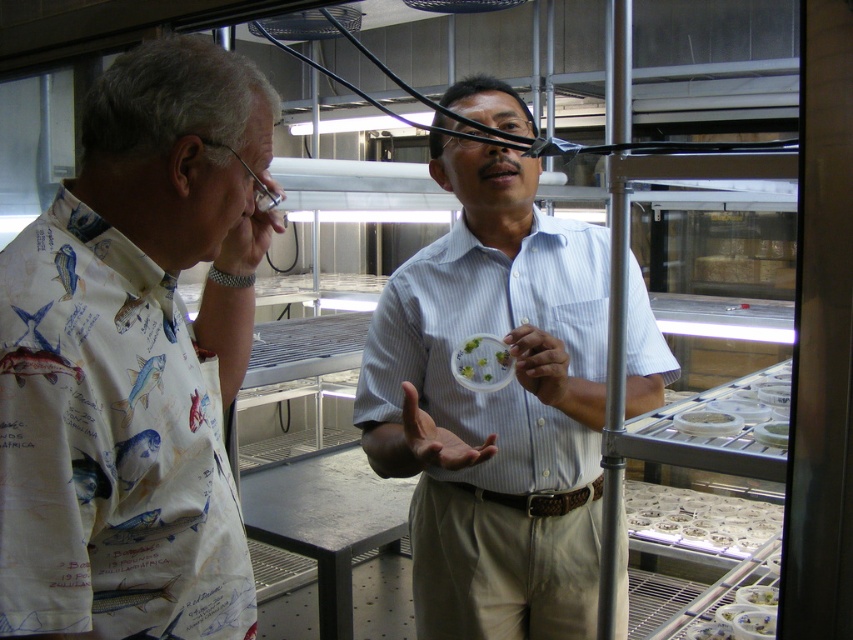
You are standing at point [682,416] in the lab. The two people are talking. Can you hear their conversation clearly?

The two people are 4.54 feet apart, so yes, you can hear their conversation clearly from point [682,416].

You are a researcher in the lab and need to determine which object is bigger between the white striped shirt at center and the translucent plastic container at center. Which one is larger?

The white striped shirt at center is larger than the translucent plastic container at center according to the description.